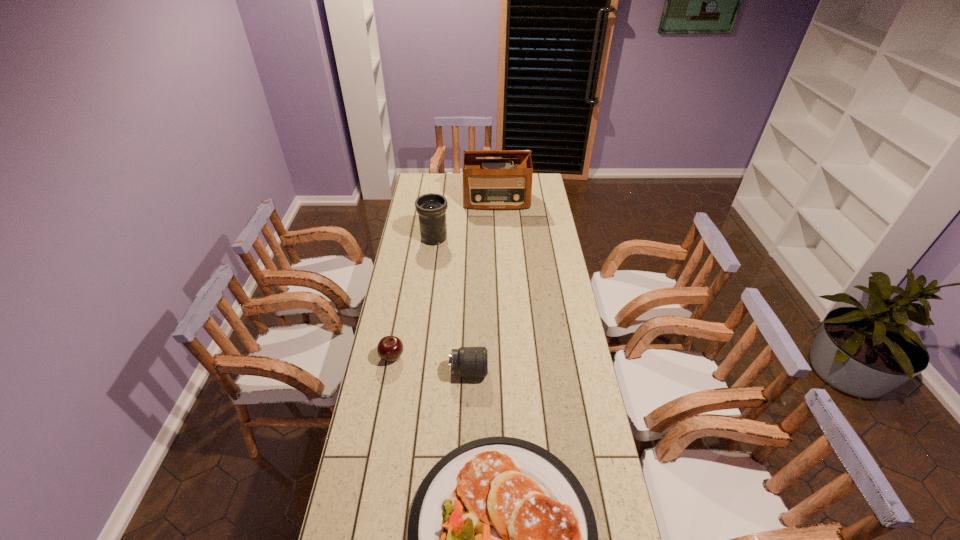
Where is `the tallest object`? The image size is (960, 540). the tallest object is located at coordinates (497, 183).

This screenshot has height=540, width=960. I want to click on radio receiver, so click(497, 183).

Image resolution: width=960 pixels, height=540 pixels. In order to click on the fourth nearest object in this screenshot , I will do `click(431, 208)`.

You are a GUI agent. You are given a task and a screenshot of the screen. Output one action in this format:
    pyautogui.click(x=<x>, y=<y>)
    Task: Click on the second tallest object
    Image resolution: width=960 pixels, height=540 pixels.
    Given the screenshot: What is the action you would take?
    pyautogui.click(x=431, y=208)

The height and width of the screenshot is (540, 960). What are the coordinates of `the right telephoto lens` in the screenshot? It's located at (466, 361).

Where is `the nearer telephoto lens`? Image resolution: width=960 pixels, height=540 pixels. the nearer telephoto lens is located at coordinates (466, 361).

This screenshot has width=960, height=540. I want to click on apple, so click(390, 348).

Where is `vacant region located on the front panel of the radio receiver`? vacant region located on the front panel of the radio receiver is located at coordinates (498, 230).

Identify the location of vacant region located 0.350m on the right of the taller telephoto lens. (518, 238).

This screenshot has width=960, height=540. I want to click on free space located on the surface of the right telephoto lens, so click(528, 372).